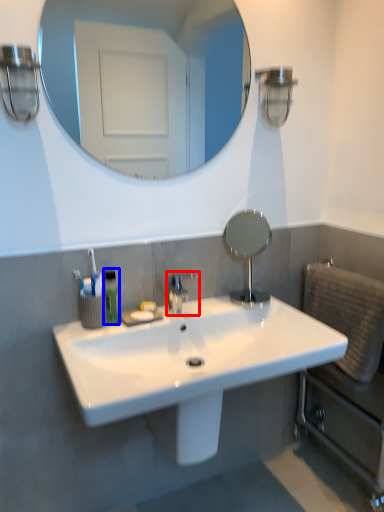
Question: Which object appears farthest to the camera in this image, tap (highlighted by a red box) or mouthwash (highlighted by a blue box)?

Choices:
 (A) tap
 (B) mouthwash

Answer: (A)